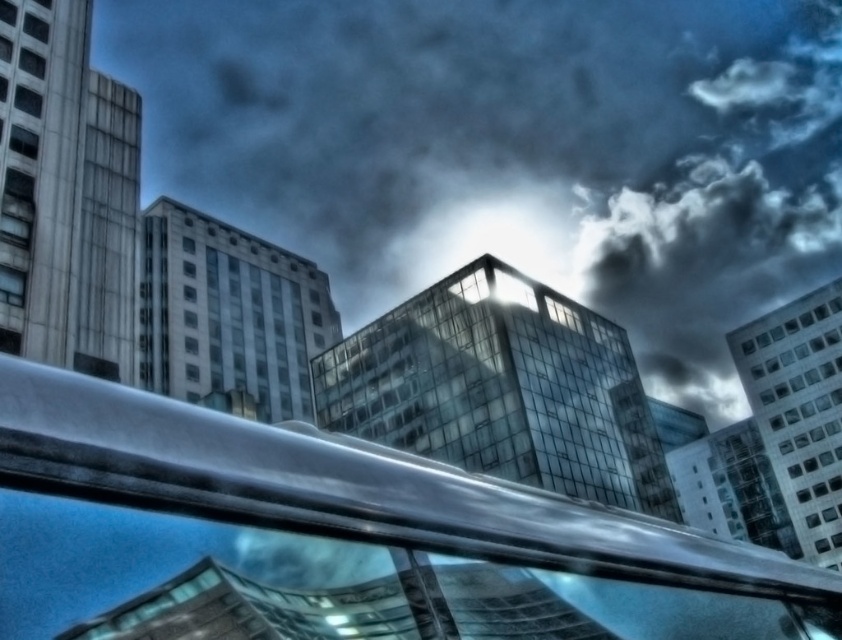
Question: Which object appears closest to the camera in this image?

Choices:
 (A) metallic silver railing at center
 (B) transparent glass building at center

Answer: (A)

Question: Is transparent glass building at center to the right of metallic silver railing at center from the viewer's perspective?

Choices:
 (A) yes
 (B) no

Answer: (A)

Question: Considering the relative positions of transparent glass building at center and metallic silver railing at center in the image provided, where is transparent glass building at center located with respect to metallic silver railing at center?

Choices:
 (A) below
 (B) above

Answer: (B)

Question: Among these objects, which one is farthest from the camera?

Choices:
 (A) metallic silver railing at center
 (B) transparent glass building at center

Answer: (B)

Question: Does transparent glass building at center have a smaller size compared to metallic silver railing at center?

Choices:
 (A) yes
 (B) no

Answer: (B)